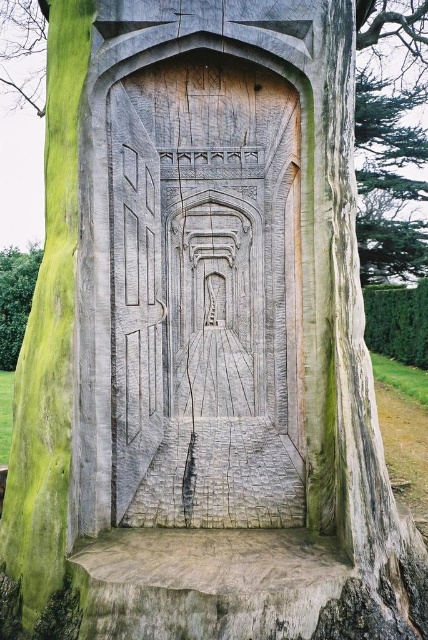
You are standing in front of a tree stump with a carved wooden door. There is a point marked at coordinates (205, 296). What does this point represent?

The point at coordinates (205, 296) represents the carved wood door at center.

You are standing in a forest and see the carved wood door at center. If you want to reach the door, how many steps would you estimate you need to take to get there?

The carved wood door at center is 1.61 meters away, so you would need to take approximately 2 steps to reach it, assuming an average step length of about 0.8 meters per step.